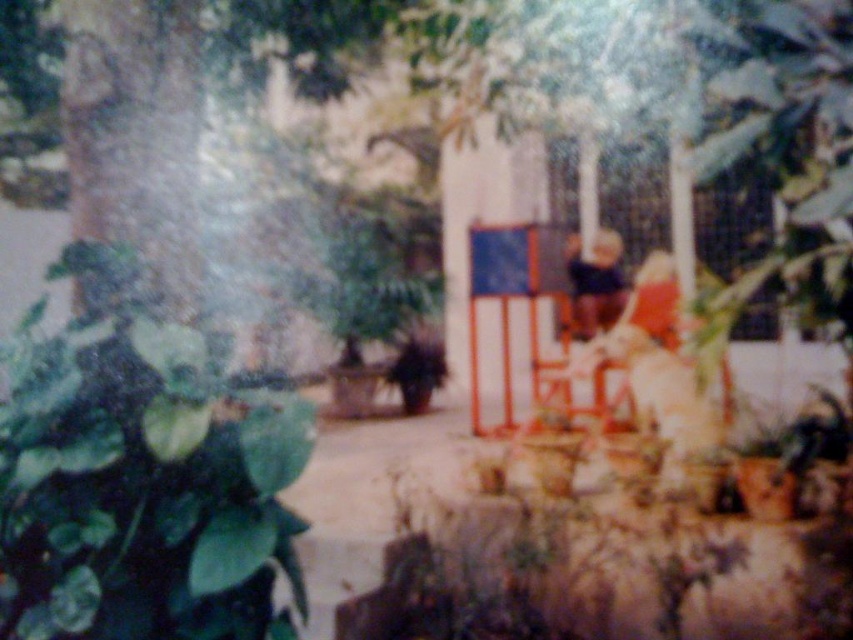
Question: Can you confirm if green matte leaf at lower left is bigger than dark blue fabric at center?

Choices:
 (A) yes
 (B) no

Answer: (A)

Question: Which of the following is the closest to the observer?

Choices:
 (A) (26, 387)
 (B) (607, 292)
 (C) (592, 413)

Answer: (A)

Question: Is green matte leaf at lower left above dark blue fabric at center?

Choices:
 (A) yes
 (B) no

Answer: (B)

Question: Is green matte leaf at lower left thinner than wooden chair at center?

Choices:
 (A) yes
 (B) no

Answer: (A)

Question: Which point is closer to the camera?

Choices:
 (A) (276, 522)
 (B) (619, 337)
 (C) (593, 305)

Answer: (A)

Question: Which of the following is the farthest from the observer?

Choices:
 (A) (633, 300)
 (B) (45, 410)
 (C) (611, 268)

Answer: (C)